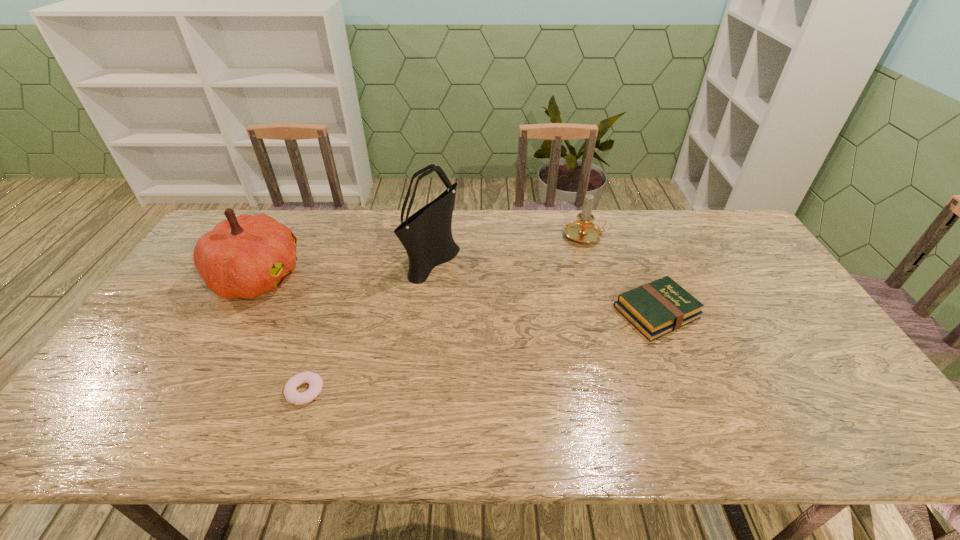
Select which object appears as the fourth closest to the candle. Please provide its 2D coordinates. Your answer should be formatted as a tuple, i.e. [(x, y)], where the tuple contains the x and y coordinates of a point satisfying the conditions above.

[(315, 382)]

Locate an element on the screen. The width and height of the screenshot is (960, 540). the fourth closest object to the third tallest object is located at coordinates pos(315,382).

At what (x,y) coordinates should I click in order to perform the action: click on vacant space that satisfies the following two spatial constraints: 1. on the front side of the book; 2. on the right side of the candle. Please return your answer as a coordinate pair (x, y). This screenshot has width=960, height=540. Looking at the image, I should click on (610, 312).

You are a GUI agent. You are given a task and a screenshot of the screen. Output one action in this format:
    pyautogui.click(x=<x>, y=<y>)
    Task: Click on the free location that satisfies the following two spatial constraints: 1. on the front side of the candle; 2. on the front-facing side of the second tallest object
    
    Given the screenshot: What is the action you would take?
    pyautogui.click(x=599, y=277)

Find the location of `blank area in the image that satisfies the following two spatial constraints: 1. on the back side of the fourth tallest object; 2. on the front-facing side of the pumpkin`. blank area in the image that satisfies the following two spatial constraints: 1. on the back side of the fourth tallest object; 2. on the front-facing side of the pumpkin is located at coordinates (642, 277).

The image size is (960, 540). Identify the location of vacant position in the image that satisfies the following two spatial constraints: 1. on the back side of the second shortest object; 2. on the front-facing side of the leftmost object. (642, 277).